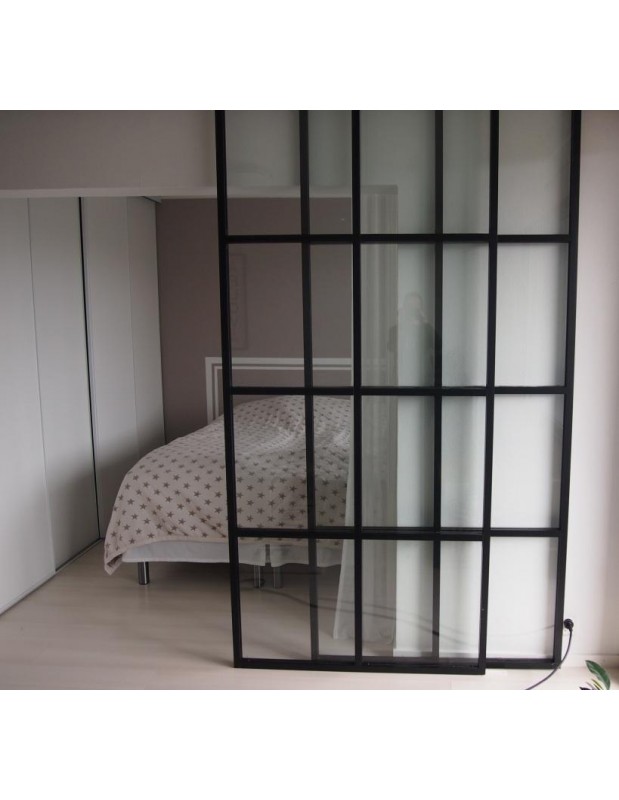
Where is `white sheet under duvet`? The image size is (619, 800). white sheet under duvet is located at coordinates (174, 554).